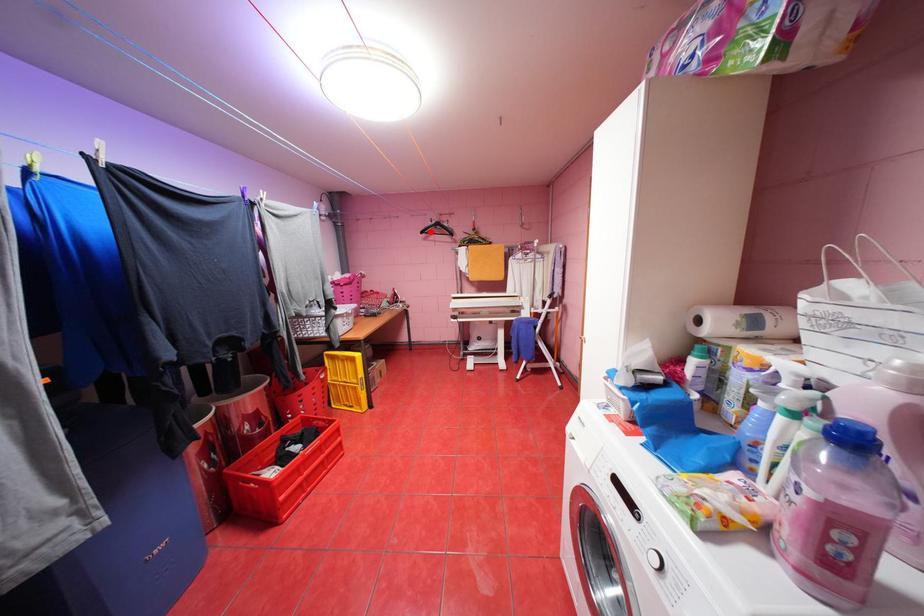
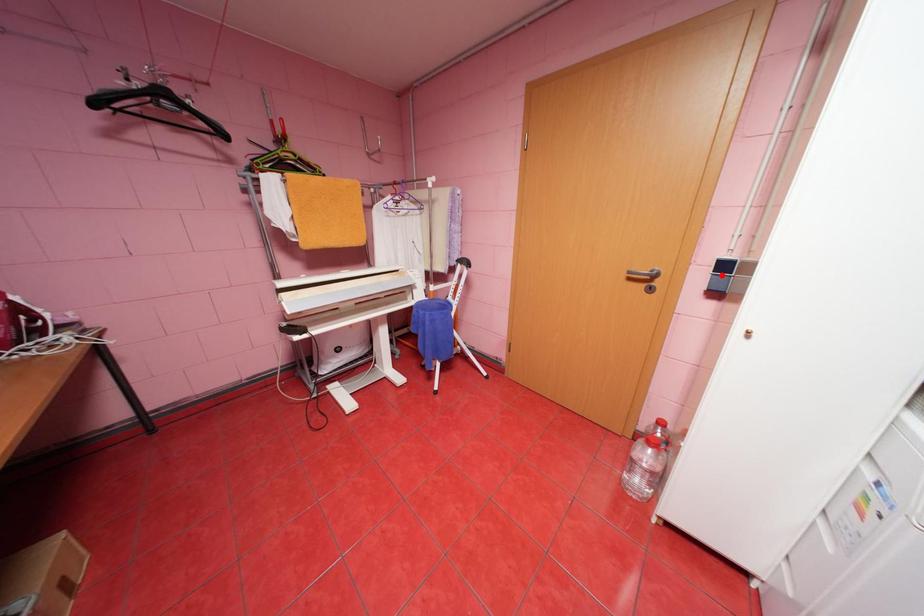
I am providing you with two images of the same scene from different viewpoints. A red point is marked on the first image and another point is marked on the second image. Do the highlighted points in image1 and image2 indicate the same real-world spot?

No